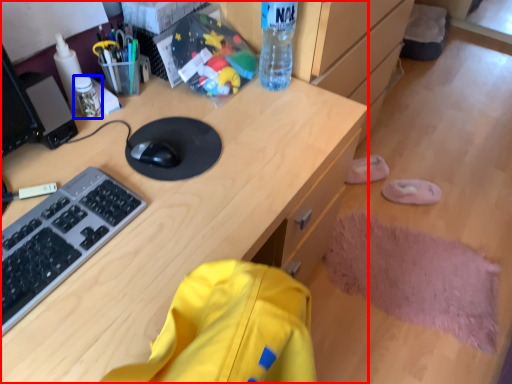
Question: Among these objects, which one is farthest to the camera, desk (highlighted by a red box) or stationery (highlighted by a blue box)?

Choices:
 (A) desk
 (B) stationery

Answer: (B)